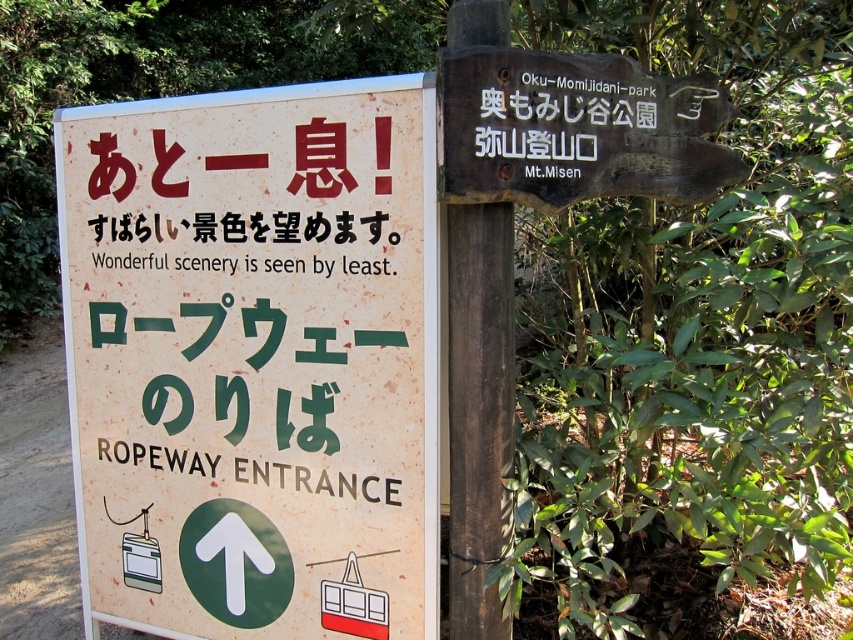
You are standing at the coordinates given in the scene description. Which direction should you face to see the beige paper sign at left?

The beige paper sign at left is located at point (254, 358), so you should face towards that coordinate to see it.

You are standing at the coordinates given in the scene description. Which direction should you face to see the beige paper sign at left?

The beige paper sign at left is located at point (254, 358), so you should face towards that coordinate to see it.